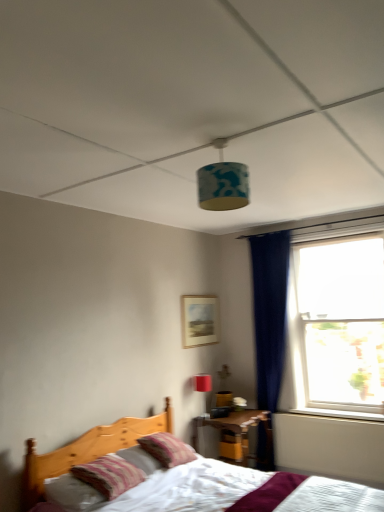
Question: Is matte red table lamp at upper center aimed at transparent glass window at right?

Choices:
 (A) no
 (B) yes

Answer: (A)

Question: Is matte red table lamp at upper center to the left of transparent glass window at right from the viewer's perspective?

Choices:
 (A) no
 (B) yes

Answer: (B)

Question: From a real-world perspective, is matte red table lamp at upper center physically above transparent glass window at right?

Choices:
 (A) yes
 (B) no

Answer: (B)

Question: Considering the relative sizes of matte red table lamp at upper center and transparent glass window at right in the image provided, is matte red table lamp at upper center smaller than transparent glass window at right?

Choices:
 (A) no
 (B) yes

Answer: (B)

Question: Is matte red table lamp at upper center with transparent glass window at right?

Choices:
 (A) no
 (B) yes

Answer: (A)

Question: Considering the relative positions of matte red table lamp at upper center and transparent glass window at right in the image provided, is matte red table lamp at upper center to the right of transparent glass window at right from the viewer's perspective?

Choices:
 (A) yes
 (B) no

Answer: (B)

Question: Is matte wooden picture frame at center bigger than white plastic window sill at lower right?

Choices:
 (A) yes
 (B) no

Answer: (A)

Question: Is white plastic window sill at lower right surrounded by matte wooden picture frame at center?

Choices:
 (A) no
 (B) yes

Answer: (A)

Question: Can you confirm if matte wooden picture frame at center is taller than white plastic window sill at lower right?

Choices:
 (A) yes
 (B) no

Answer: (A)

Question: Is matte wooden picture frame at center wider than white plastic window sill at lower right?

Choices:
 (A) yes
 (B) no

Answer: (B)

Question: From the image's perspective, is matte wooden picture frame at center located above white plastic window sill at lower right?

Choices:
 (A) no
 (B) yes

Answer: (B)

Question: Is the depth of matte wooden picture frame at center greater than that of white plastic window sill at lower right?

Choices:
 (A) no
 (B) yes

Answer: (B)

Question: Can you confirm if matte wooden picture frame at center is bigger than striped fabric pillow at center, arranged as the 1th pillow when viewed from the back?

Choices:
 (A) yes
 (B) no

Answer: (B)